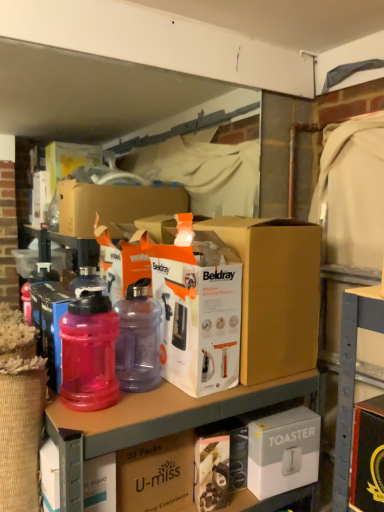
Locate an element on the screen. vacant space in front of transparent plastic water bottle at left, acting as the 1th box starting from the left is located at coordinates (73, 414).